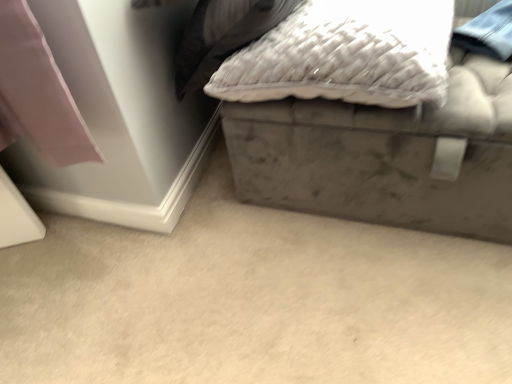
Describe the element at coordinates (253, 300) in the screenshot. The image size is (512, 384). I see `gray matte storage box at lower right` at that location.

The image size is (512, 384). Identify the location of velvet gray ottoman at upper right. (391, 150).

Which is correct: white textured pillow at upper center is inside gray matte storage box at lower right, or outside of it?

white textured pillow at upper center is located beyond the bounds of gray matte storage box at lower right.

Considering the sizes of objects white textured pillow at upper center and gray matte storage box at lower right in the image provided, who is taller, white textured pillow at upper center or gray matte storage box at lower right?

white textured pillow at upper center.

Is white textured pillow at upper center aimed at gray matte storage box at lower right?

No, white textured pillow at upper center is not aimed at gray matte storage box at lower right.

How different are the orientations of white textured pillow at upper center and gray matte storage box at lower right in degrees?

There is a 1.51-degree angle between the facing directions of white textured pillow at upper center and gray matte storage box at lower right.

Considering the relative sizes of velvet gray ottoman at upper right and gray matte storage box at lower right in the image provided, is velvet gray ottoman at upper right bigger than gray matte storage box at lower right?

Correct, velvet gray ottoman at upper right is larger in size than gray matte storage box at lower right.

Is velvet gray ottoman at upper right placed right next to gray matte storage box at lower right?

No, velvet gray ottoman at upper right is not beside gray matte storage box at lower right.

Consider the image. From a real-world perspective, who is located lower, velvet gray ottoman at upper right or gray matte storage box at lower right?

gray matte storage box at lower right, from a real-world perspective.

Is gray matte storage box at lower right wider or thinner than velvet gray ottoman at upper right?

Clearly, gray matte storage box at lower right has more width compared to velvet gray ottoman at upper right.

Is gray matte storage box at lower right not inside velvet gray ottoman at upper right?

Yes, gray matte storage box at lower right is located beyond the bounds of velvet gray ottoman at upper right.

Measure the distance between gray matte storage box at lower right and velvet gray ottoman at upper right.

They are 10.63 inches apart.

Does gray matte storage box at lower right come in front of velvet gray ottoman at upper right?

Yes, it is.

Which of these two, gray matte storage box at lower right or white textured pillow at upper center, is wider?

Wider between the two is gray matte storage box at lower right.

From the image's perspective, is gray matte storage box at lower right above white textured pillow at upper center?

No, from the image's perspective, gray matte storage box at lower right is not over white textured pillow at upper center.

You are a GUI agent. You are given a task and a screenshot of the screen. Output one action in this format:
    pyautogui.click(x=<x>, y=<y>)
    Task: Click on the pillow above the gray matte storage box at lower right (from the image's perspective)
    The image size is (512, 384).
    Given the screenshot: What is the action you would take?
    pyautogui.click(x=346, y=55)

Which is further, (119, 275) or (300, 24)?

The point (119, 275) is farther from the camera.

Does velvet gray ottoman at upper right have a smaller size compared to white textured pillow at upper center?

No.

Who is more distant, velvet gray ottoman at upper right or white textured pillow at upper center?

velvet gray ottoman at upper right is further from the camera.

From a real-world perspective, is velvet gray ottoman at upper right on white textured pillow at upper center?

Incorrect, from a real-world perspective, velvet gray ottoman at upper right is lower than white textured pillow at upper center.

Can you tell me how much velvet gray ottoman at upper right and white textured pillow at upper center differ in facing direction?

They differ by 0.000273 degrees in their facing directions.

This screenshot has width=512, height=384. Find the location of `pillow located in front of the velvet gray ottoman at upper right`. pillow located in front of the velvet gray ottoman at upper right is located at coordinates (346, 55).

Between point (376, 58) and point (385, 112), which one is positioned in front?

The point (376, 58) is more forward.

Between white textured pillow at upper center and velvet gray ottoman at upper right, which one has more height?

Standing taller between the two is velvet gray ottoman at upper right.

Is white textured pillow at upper center with velvet gray ottoman at upper right?

No, white textured pillow at upper center is not beside velvet gray ottoman at upper right.

Where is `concrete below the white textured pillow at upper center (from a real-world perspective)`? concrete below the white textured pillow at upper center (from a real-world perspective) is located at coordinates (253, 300).

Identify the location of furniture behind the gray matte storage box at lower right. The width and height of the screenshot is (512, 384). (391, 150).

Based on their spatial positions, is velvet gray ottoman at upper right or gray matte storage box at lower right closer to white textured pillow at upper center?

The object closer to white textured pillow at upper center is velvet gray ottoman at upper right.

Considering their positions, is gray matte storage box at lower right positioned closer to velvet gray ottoman at upper right than white textured pillow at upper center?

white textured pillow at upper center is closer to velvet gray ottoman at upper right.

Which object lies further to the anchor point gray matte storage box at lower right, velvet gray ottoman at upper right or white textured pillow at upper center?

The object further to gray matte storage box at lower right is white textured pillow at upper center.

Considering their positions, is white textured pillow at upper center positioned further to gray matte storage box at lower right than velvet gray ottoman at upper right?

white textured pillow at upper center lies further to gray matte storage box at lower right than the other object.

Considering their positions, is white textured pillow at upper center positioned closer to velvet gray ottoman at upper right than gray matte storage box at lower right?

Based on the image, white textured pillow at upper center appears to be nearer to velvet gray ottoman at upper right.

Considering their positions, is gray matte storage box at lower right positioned closer to white textured pillow at upper center than velvet gray ottoman at upper right?

velvet gray ottoman at upper right is closer to white textured pillow at upper center.

The image size is (512, 384). Find the location of `furniture between white textured pillow at upper center and gray matte storage box at lower right vertically`. furniture between white textured pillow at upper center and gray matte storage box at lower right vertically is located at coordinates (391, 150).